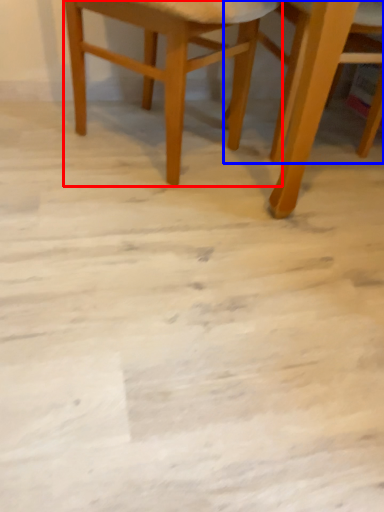
Question: Which point is further to the camera, chair (highlighted by a red box) or chair (highlighted by a blue box)?

Choices:
 (A) chair
 (B) chair

Answer: (A)